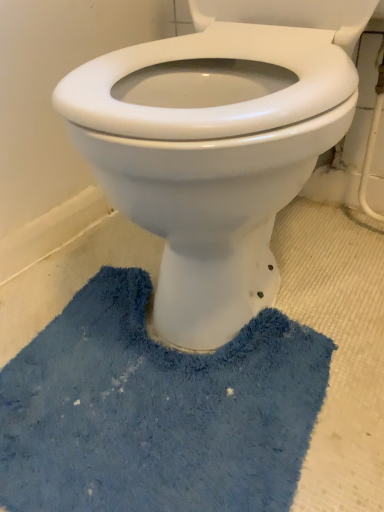
Locate an element on the screen. This screenshot has height=512, width=384. free space above blue fuzzy bath mat at lower center (from a real-world perspective) is located at coordinates (177, 370).